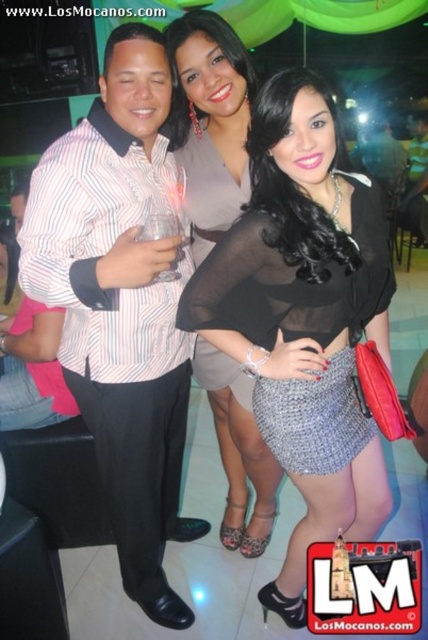
Question: Considering the relative positions of striped cotton shirt at center and black sheer dress at center in the image provided, where is striped cotton shirt at center located with respect to black sheer dress at center?

Choices:
 (A) right
 (B) left

Answer: (B)

Question: Which point is farther to the camera?

Choices:
 (A) (216, 372)
 (B) (315, 428)

Answer: (A)

Question: Among these objects, which one is nearest to the camera?

Choices:
 (A) black sheer blouse at center
 (B) striped cotton shirt at center

Answer: (A)

Question: Is matte gray dress at center in front of black sheer dress at center?

Choices:
 (A) no
 (B) yes

Answer: (A)

Question: Is black sheer blouse at center closer to the viewer compared to striped cotton shirt at center?

Choices:
 (A) yes
 (B) no

Answer: (A)

Question: Which object is positioned farthest from the black sheer dress at center?

Choices:
 (A) matte gray dress at center
 (B) striped cotton shirt at center

Answer: (A)